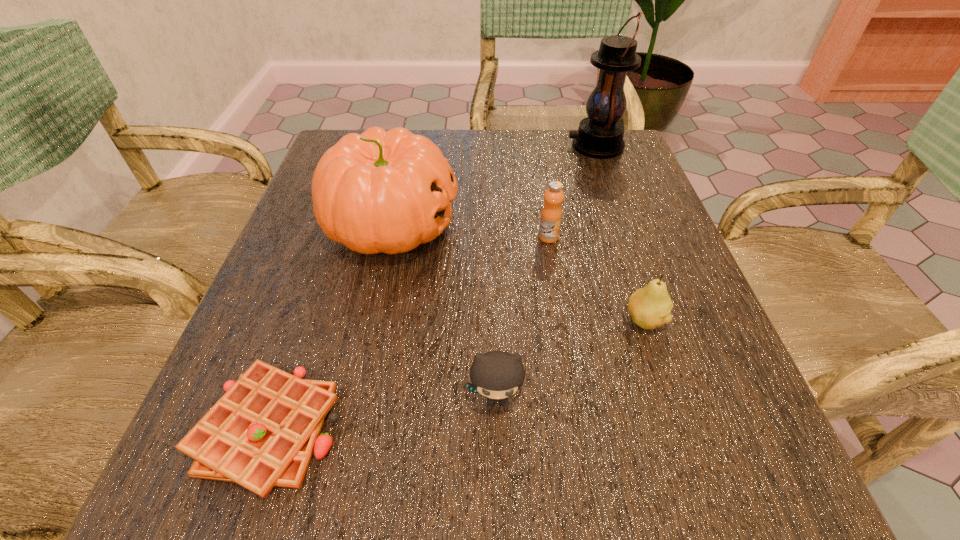
The image size is (960, 540). Find the location of `free space that is in between the pumpkin and the pear`. free space that is in between the pumpkin and the pear is located at coordinates (517, 272).

Where is `free space between the lantern and the orange juice`? free space between the lantern and the orange juice is located at coordinates (572, 192).

You are a GUI agent. You are given a task and a screenshot of the screen. Output one action in this format:
    pyautogui.click(x=<x>, y=<y>)
    Task: Click on the vacant region between the lantern and the third object from right to left
    
    Given the screenshot: What is the action you would take?
    pyautogui.click(x=572, y=192)

The height and width of the screenshot is (540, 960). Find the location of `vacant area that lies between the lantern and the fifth shortest object`. vacant area that lies between the lantern and the fifth shortest object is located at coordinates (493, 185).

Image resolution: width=960 pixels, height=540 pixels. I want to click on free point between the pear and the kitten, so click(570, 361).

The image size is (960, 540). I want to click on free spot between the waffle and the fifth shortest object, so click(330, 326).

In order to click on free space between the waffle and the fourth object from right to left in this screenshot , I will do `click(382, 415)`.

You are a GUI agent. You are given a task and a screenshot of the screen. Output one action in this format:
    pyautogui.click(x=<x>, y=<y>)
    Task: Click on the unoccupied position between the kitten and the pear
    
    Given the screenshot: What is the action you would take?
    pyautogui.click(x=570, y=361)

In order to click on free space between the fourth farthest object and the third object from left to right in this screenshot , I will do `click(570, 361)`.

This screenshot has height=540, width=960. What are the coordinates of `blank region between the shortest object and the fourth farthest object` in the screenshot? It's located at (456, 375).